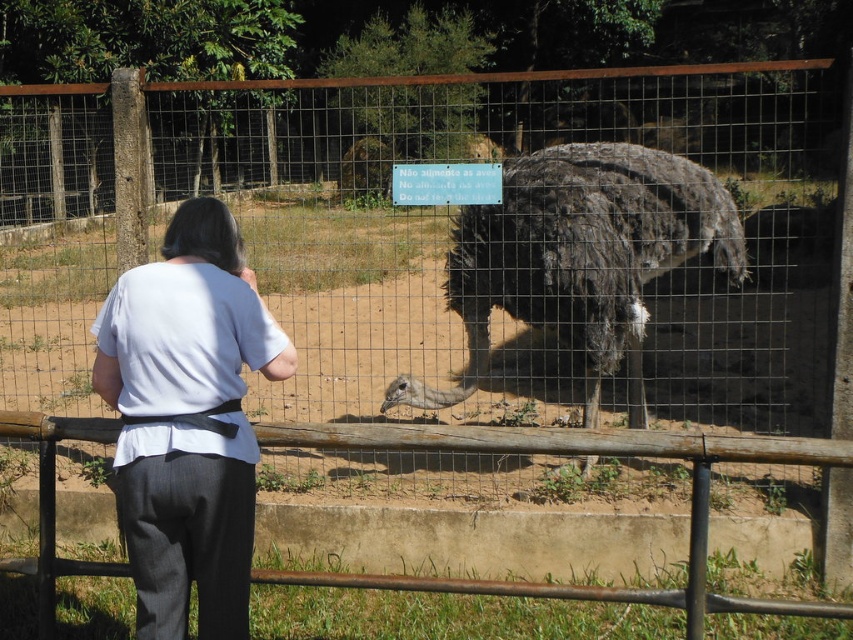
Between white fabric at center and dark brown feathered ostrich at center, which one appears on the left side from the viewer's perspective?

white fabric at center

Is white fabric at center smaller than dark brown feathered ostrich at center?

Indeed, white fabric at center has a smaller size compared to dark brown feathered ostrich at center.

Is point (230, 544) farther from camera compared to point (651, 182)?

No, (230, 544) is in front of (651, 182).

The height and width of the screenshot is (640, 853). Identify the location of white fabric at center. (187, 420).

Can you confirm if dark brown feathered ostrich at center is wider than rusty metal rail at lower center?

Incorrect, dark brown feathered ostrich at center's width does not surpass rusty metal rail at lower center's.

Is dark brown feathered ostrich at center taller than rusty metal rail at lower center?

Correct, dark brown feathered ostrich at center is much taller as rusty metal rail at lower center.

Is point (515, 236) farther from camera compared to point (48, 500)?

Yes, point (515, 236) is farther from viewer.

This screenshot has width=853, height=640. In order to click on dark brown feathered ostrich at center in this screenshot , I will do `click(579, 259)`.

Which is in front, point (250, 301) or point (660, 451)?

Positioned in front is point (250, 301).

Can you confirm if white fabric at center is positioned to the left of rusty metal rail at lower center?

Indeed, white fabric at center is positioned on the left side of rusty metal rail at lower center.

Does point (273, 349) come behind point (360, 435)?

That is False.

Find the location of a particular element. This screenshot has width=853, height=640. white fabric at center is located at coordinates (187, 420).